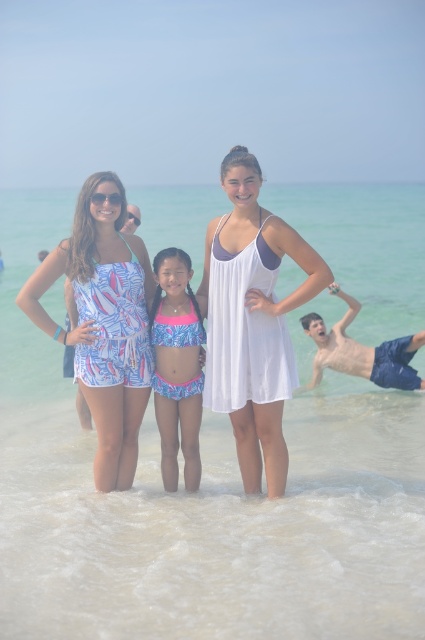
You are a photographer trying to capture a shot of the clear water at center and the white sheer dress at center. Which object would you focus on first if you want to include both in your frame without moving the camera?

The clear water at center is larger in size than the white sheer dress at center, so focusing on the larger clear water at center first would ensure it fits well in the frame before adjusting for the smaller white sheer dress at center.

You are a photographer standing at the beach and want to take a group photo of the three people in the water. The camera you are using has a maximum focus range of 5 meters. Can you capture the white sheer dress at center clearly in your photo?

The white sheer dress at center is 5.39 meters away from the camera, which exceeds the maximum focus range of 5 meters. Therefore, the dress will be out of focus and not captured clearly.